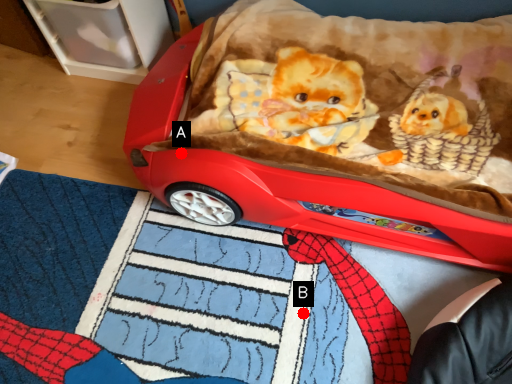
Question: Two points are circled on the image, labeled by A and B beside each circle. Among these points, which one is nearest to the camera?

Choices:
 (A) A is closer
 (B) B is closer

Answer: (A)